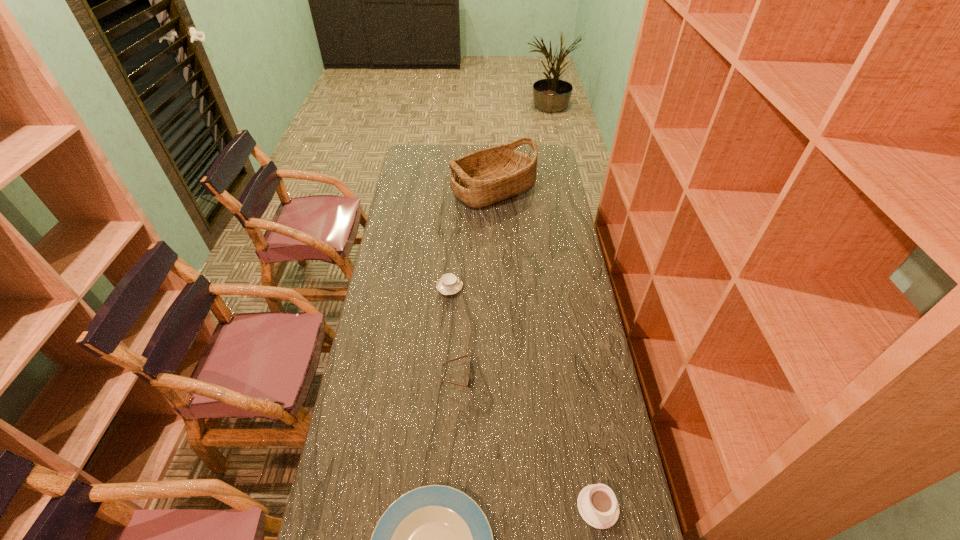
You are a GUI agent. You are given a task and a screenshot of the screen. Output one action in this format:
    pyautogui.click(x=<x>, y=<y>)
    Task: Click on the vacant space located 0.100m on the side with the handle of the farther teacup
    
    Given the screenshot: What is the action you would take?
    pyautogui.click(x=490, y=288)

The height and width of the screenshot is (540, 960). Find the location of `free region located 0.150m on the frames of the sunglasses`. free region located 0.150m on the frames of the sunglasses is located at coordinates (518, 376).

Identify the location of object at the far edge. (487, 176).

Image resolution: width=960 pixels, height=540 pixels. I want to click on basket located in the right edge section of the desktop, so click(x=487, y=176).

Locate an element on the screen. teacup located in the right edge section of the desktop is located at coordinates [x=597, y=504].

The height and width of the screenshot is (540, 960). Identify the location of object located at the far right corner. (487, 176).

The width and height of the screenshot is (960, 540). Find the location of `free space at the far edge of the desktop`. free space at the far edge of the desktop is located at coordinates (473, 146).

Where is `vacant region at the left edge of the desktop`? vacant region at the left edge of the desktop is located at coordinates (418, 225).

In the image, there is a desktop. Where is `free space at the right edge`? The width and height of the screenshot is (960, 540). free space at the right edge is located at coordinates (x=569, y=434).

You are a GUI agent. You are given a task and a screenshot of the screen. Output one action in this format:
    pyautogui.click(x=<x>, y=<y>)
    Task: Click on the blank region between the right teacup and the third nearest object
    The width and height of the screenshot is (960, 540).
    Given the screenshot: What is the action you would take?
    pyautogui.click(x=527, y=441)